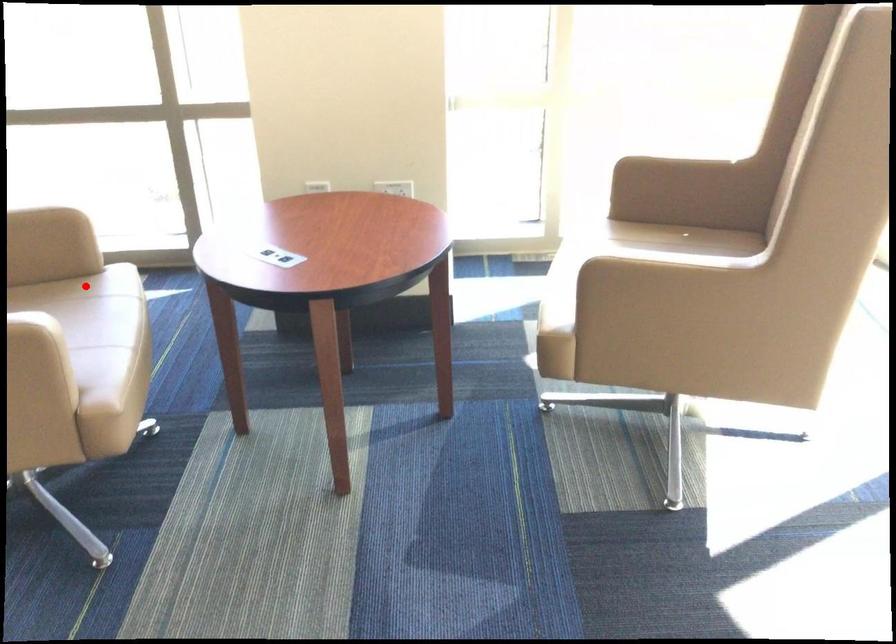
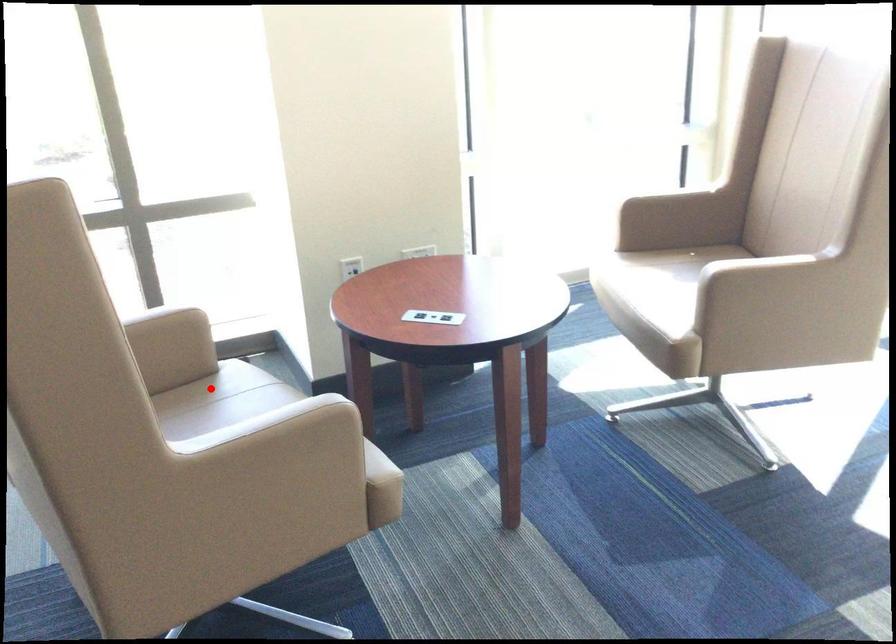
I am providing you with two images of the same scene from different viewpoints. A red point is marked on the first image and another point is marked on the second image. Is the marked point in image1 the same physical position as the marked point in image2?

Yes